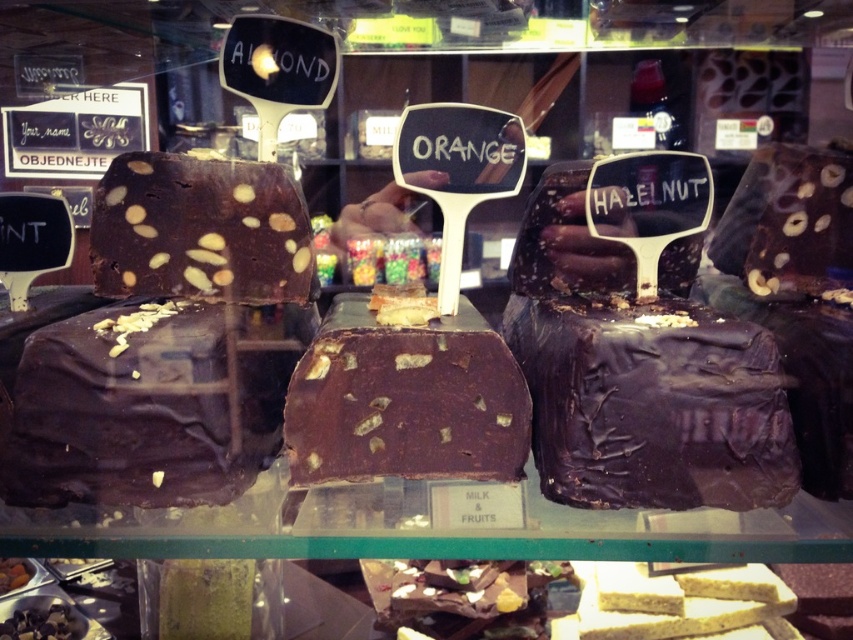
Question: Which object is closer to the camera taking this photo?

Choices:
 (A) shiny dark chocolate at center
 (B) shiny dark chocolate cake at left
 (C) shiny dark chocolate cake at center
 (D) chocolatesmoothcake at center

Answer: (B)

Question: Among these points, which one is nearest to the camera?

Choices:
 (A) 293,276
 (B) 247,337
 (C) 601,316

Answer: (C)

Question: Does chocolatesmoothcake at center appear on the left side of shiny dark chocolate at center?

Choices:
 (A) no
 (B) yes

Answer: (A)

Question: Is shiny dark chocolate cake at left positioned behind chocolatesmoothcake at center?

Choices:
 (A) no
 (B) yes

Answer: (A)

Question: Does chocolatesmoothcake at center have a lesser width compared to shiny dark chocolate at center?

Choices:
 (A) yes
 (B) no

Answer: (A)

Question: Which object is positioned closest to the shiny dark chocolate cake at left?

Choices:
 (A) shiny dark chocolate cake at center
 (B) chocolatesmoothcake at center

Answer: (B)